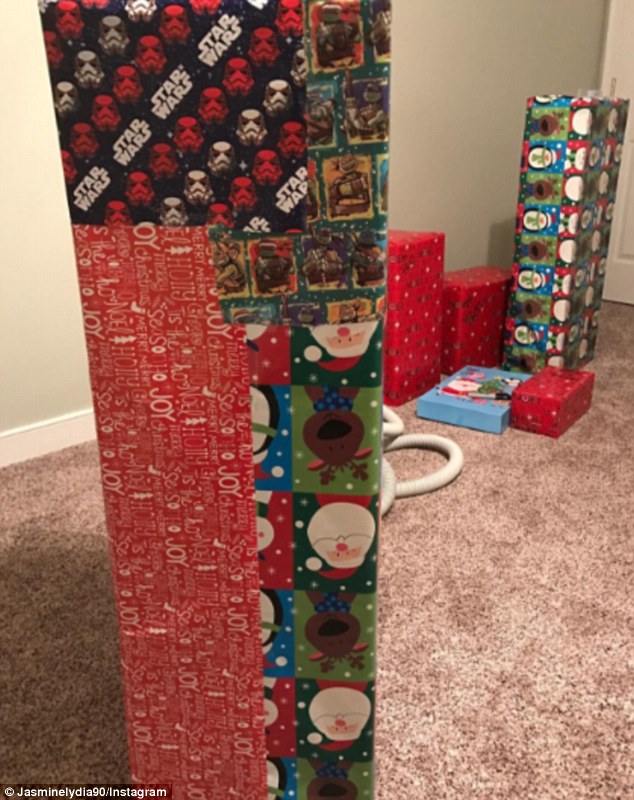
Where is `door`? The width and height of the screenshot is (634, 800). door is located at coordinates (626, 250).